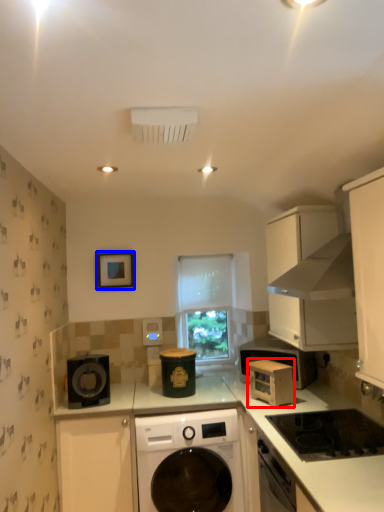
Question: Which point is closer to the camera, microwave oven (highlighted by a red box) or picture frame (highlighted by a blue box)?

Choices:
 (A) microwave oven
 (B) picture frame

Answer: (A)